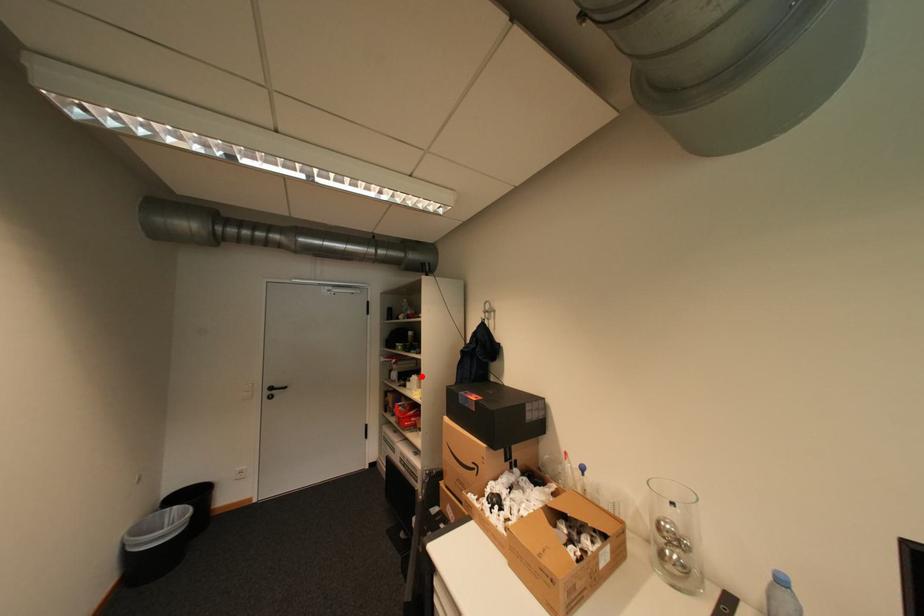
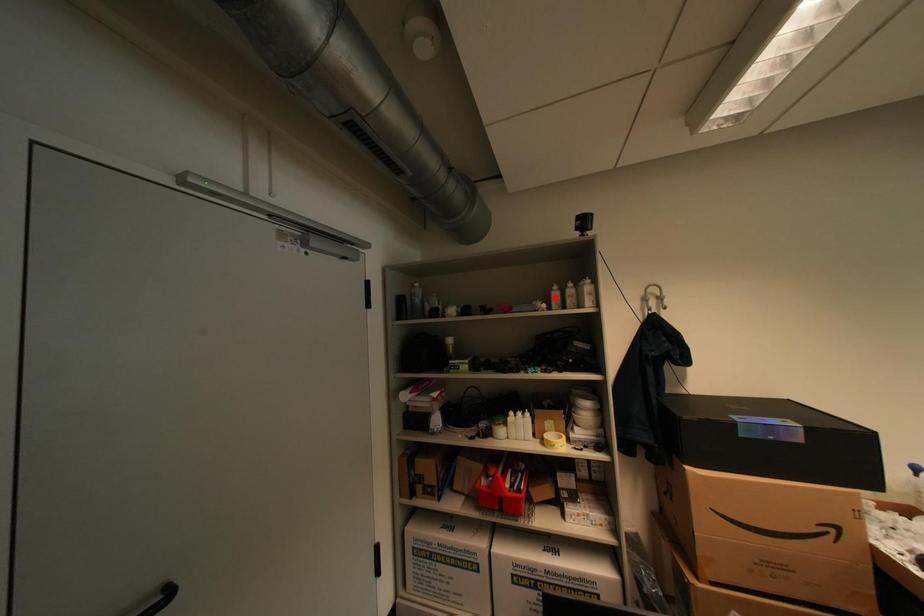
I am providing you with two images of the same scene from different viewpoints. A red point is marked on the first image and another point is marked on the second image. Do the highlighted points in image1 and image2 indicate the same real-world spot?

No